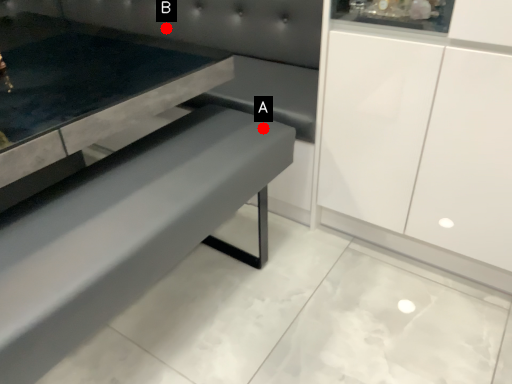
Question: Two points are circled on the image, labeled by A and B beside each circle. Which of the following is the closest to the observer?

Choices:
 (A) A is closer
 (B) B is closer

Answer: (A)